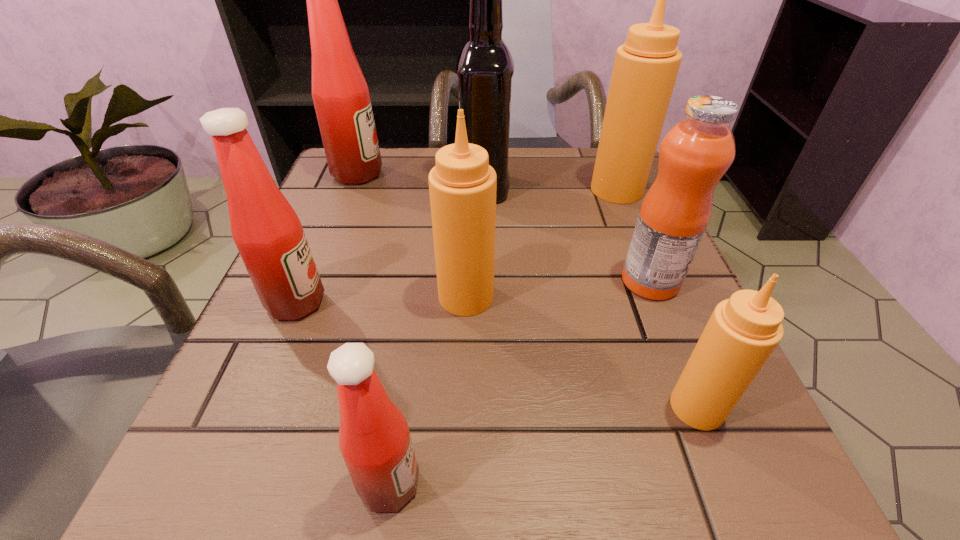
I want to click on object that stands as the seventh closest to the second farthest red condiment, so click(646, 66).

At what (x,y) coordinates should I click in order to perform the action: click on object that is the third closest to the fruit juice. Please return your answer as a coordinate pair (x, y). This screenshot has width=960, height=540. Looking at the image, I should click on (462, 186).

Locate which condiment ranks third in proximity to the seventh farthest object. Please provide its 2D coordinates. Your answer should be formatted as a tuple, i.e. [(x, y)], where the tuple contains the x and y coordinates of a point satisfying the conditions above.

[(646, 66)]

Find the location of a particular element. The height and width of the screenshot is (540, 960). condiment that is the sixth closest one to the liquor is located at coordinates (374, 439).

At what (x,y) coordinates should I click in order to perform the action: click on the closest red condiment relative to the nearest red condiment. Please return your answer as a coordinate pair (x, y). The image size is (960, 540). Looking at the image, I should click on (268, 234).

Identify the location of the second closest red condiment to the nearest condiment. (341, 97).

Locate which tan condiment is the third closest to the nearest red condiment. Please provide its 2D coordinates. Your answer should be formatted as a tuple, i.e. [(x, y)], where the tuple contains the x and y coordinates of a point satisfying the conditions above.

[(646, 66)]

Where is `tan condiment that is the second nearest to the biggest tan condiment`? This screenshot has width=960, height=540. tan condiment that is the second nearest to the biggest tan condiment is located at coordinates (743, 331).

Find the location of a particular element. The height and width of the screenshot is (540, 960). free space that satisfies the following two spatial constraints: 1. on the front-facing side of the biggest red condiment; 2. on the left side of the smallest tan condiment is located at coordinates click(265, 407).

I want to click on vacant space that satisfies the following two spatial constraints: 1. on the front-facing side of the fruit juice; 2. on the left side of the black liquor, so click(486, 281).